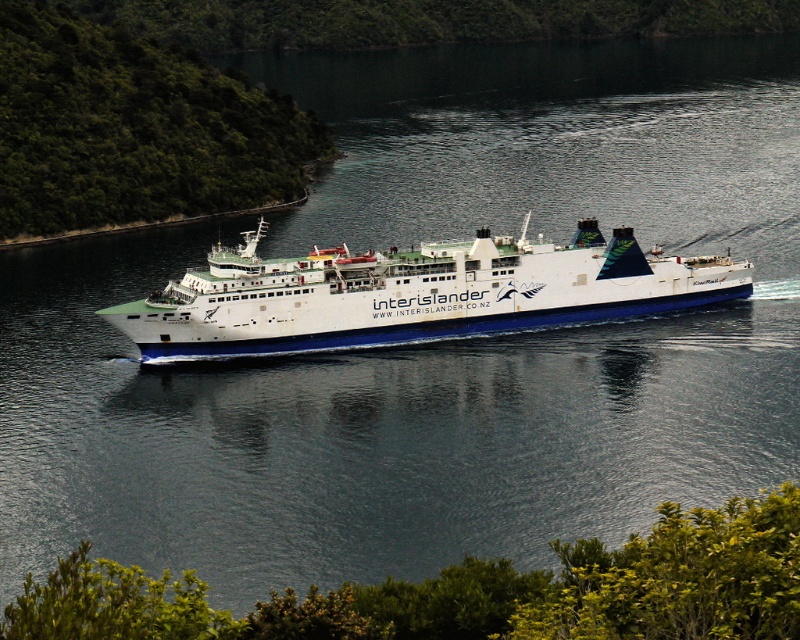
Question: Can you confirm if green leafy shrub at lower center is positioned below green leafy trees at upper left?

Choices:
 (A) yes
 (B) no

Answer: (A)

Question: Which point is closer to the camera?

Choices:
 (A) white matte ferry at center
 (B) green leafy shrub at lower center
 (C) green leafy trees at upper left

Answer: (B)

Question: Can you confirm if green leafy shrub at lower center is positioned below white matte ferry at center?

Choices:
 (A) yes
 (B) no

Answer: (A)

Question: Which object is the farthest from the green leafy trees at upper left?

Choices:
 (A) white matte ferry at center
 (B) green leafy shrub at lower center

Answer: (B)

Question: Which point is closer to the camera?

Choices:
 (A) (210, 128)
 (B) (284, 314)

Answer: (B)

Question: Can you confirm if green leafy shrub at lower center is positioned below green leafy trees at upper left?

Choices:
 (A) no
 (B) yes

Answer: (B)